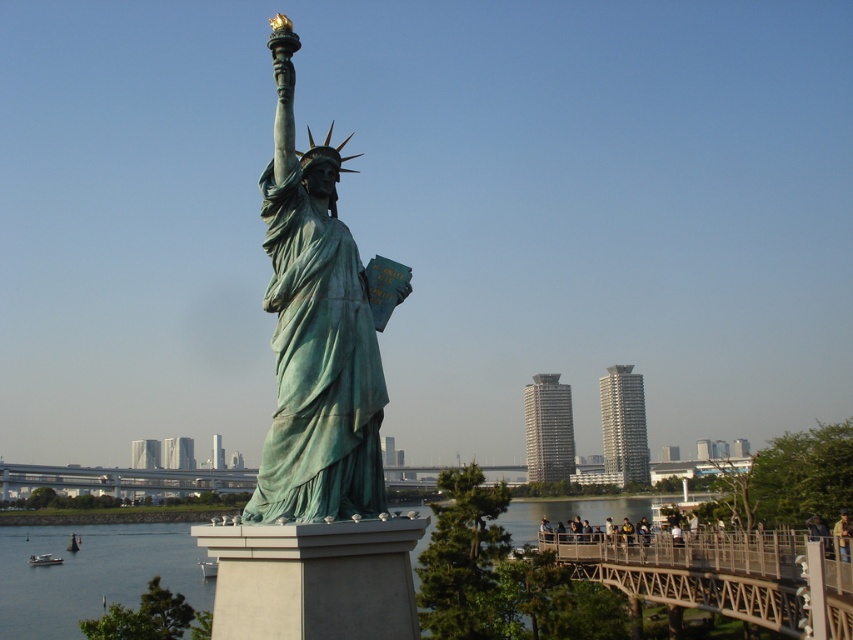
You are standing in front of the Statue of Liberty replica and want to take a photo that includes both the green patina statue at center and the green stone river at center. Since you want both to be clearly visible, which object should you focus on first to ensure proper depth of field?

Since the green patina statue at center is closer to the viewer than the green stone river at center, you should focus on the green patina statue at center first to ensure both are in focus.

You are standing in front of the Statue of Liberty replica and want to take a photo that includes both the statue and a specific landmark in the distance. The landmark is marked by the point labeled point (x=717, y=573). Which direction should you turn to ensure both the statue and the landmark are in your camera frame?

The metallic gray bridge at lower right is represented by point (x=717, y=573). To include both the Statue of Liberty replica and the metallic gray bridge at lower right in your photo, you should turn to the lower right direction where the bridge is located.

You are a photographer planning to take a photo of the Statue of Liberty replica. You want to ensure that both the metallic gray bridge at lower right and the metallic gray bridge at center are visible in the frame. Based on their positions, which bridge will appear closer to the camera in the final photo?

The metallic gray bridge at lower right will appear closer to the camera in the final photo because it is positioned in front of the metallic gray bridge at center.